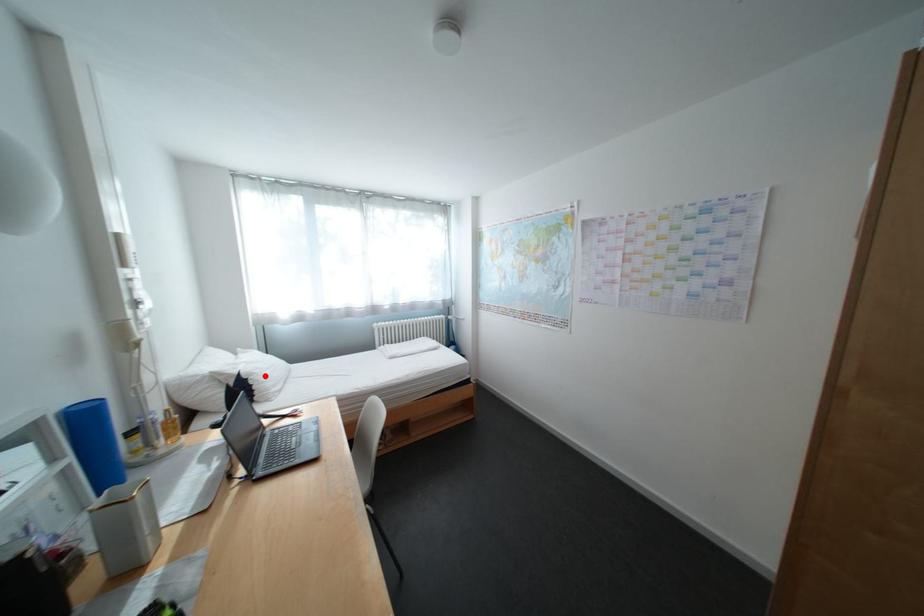
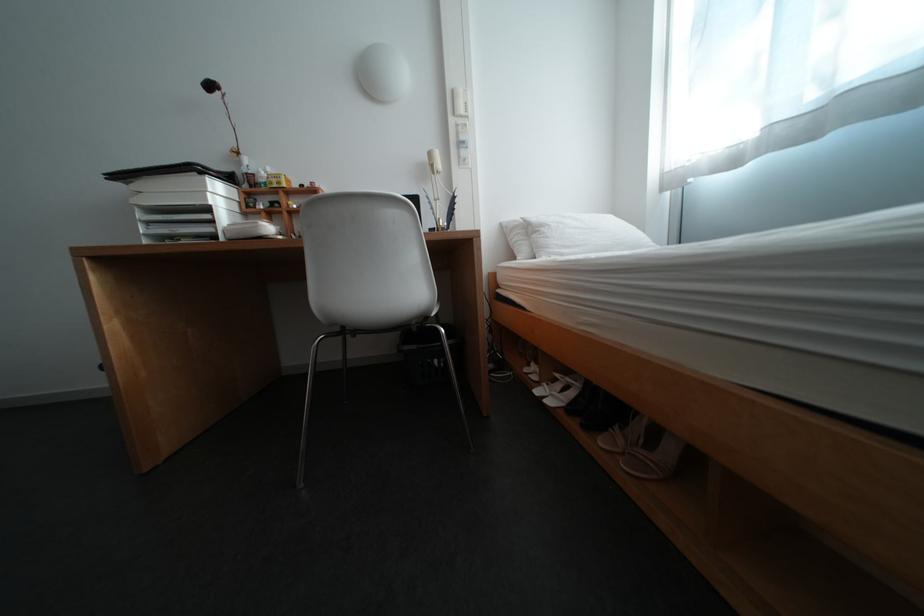
Where in the second image is the point corresponding to the highlighted location from the first image?

(555, 228)